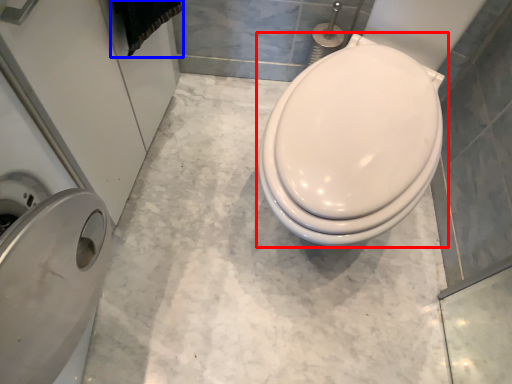
Question: Which object appears farthest to the camera in this image, toilet (highlighted by a red box) or material (highlighted by a blue box)?

Choices:
 (A) toilet
 (B) material

Answer: (B)